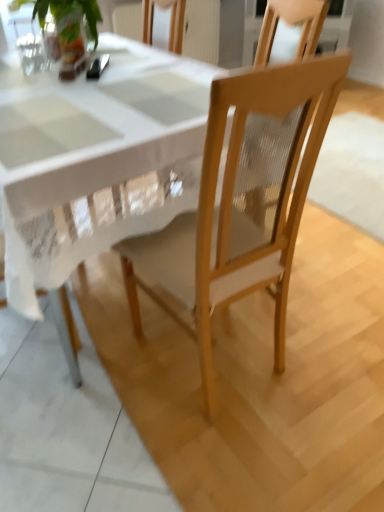
Find the location of `vacant space underneath light wood chair at center (from a real-world perspective)`. vacant space underneath light wood chair at center (from a real-world perspective) is located at coordinates (223, 360).